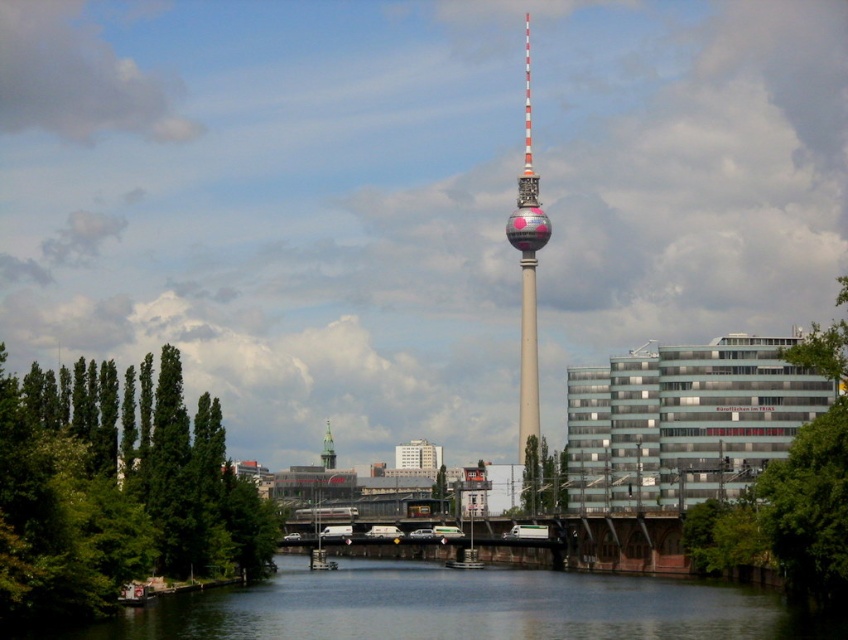
You are standing at the edge of the waterway and want to know the exact location of the smooth dark water at center. What are its coordinates?

The smooth dark water at center is located at point (461,608).

You are standing on the riverbank and see the smooth dark water at center and the silver metallic clock tower at center. Which object is closer to you?

The smooth dark water at center is closer to you because it is positioned below the silver metallic clock tower at center.

You are standing at the edge of the waterway and want to take a photo of both the smooth dark water at center and the polished steel tower at center. Since you have a camera with a fixed focal length, you need to adjust your position so that both objects appear in focus. Which object should you focus on to ensure both are sharp?

You should focus on the polished steel tower at center because it is farther away than the smooth dark water at center, so focusing on the tower will keep both objects in focus due to the depth of field.